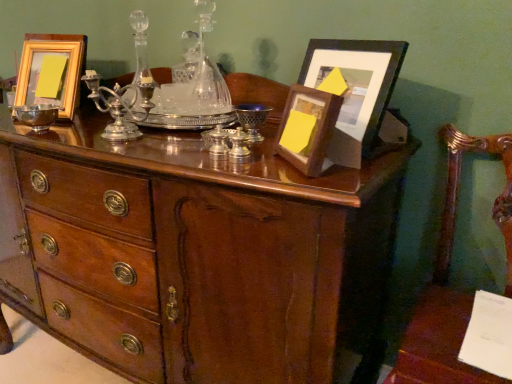
Question: From a real-world perspective, is gold wooden picture frame at upper left, which appears as the 1th picture frame when viewed from the left, physically below silver metallic candle holder at center, the second candle holder viewed from the left?

Choices:
 (A) no
 (B) yes

Answer: (A)

Question: Considering the relative sizes of gold wooden picture frame at upper left, the 3th picture frame in the right-to-left sequence, and silver metallic candle holder at center, the second candle holder viewed from the left, in the image provided, is gold wooden picture frame at upper left, the 3th picture frame in the right-to-left sequence, smaller than silver metallic candle holder at center, the second candle holder viewed from the left,?

Choices:
 (A) no
 (B) yes

Answer: (A)

Question: Is gold wooden picture frame at upper left, the 3th picture frame in the right-to-left sequence, directly adjacent to silver metallic candle holder at center, the second candle holder viewed from the left?

Choices:
 (A) no
 (B) yes

Answer: (A)

Question: Is gold wooden picture frame at upper left, the 3th picture frame in the right-to-left sequence, oriented towards silver metallic candle holder at center, the second candle holder positioned from the front?

Choices:
 (A) no
 (B) yes

Answer: (A)

Question: Can you confirm if gold wooden picture frame at upper left, the 3th picture frame in the right-to-left sequence, is thinner than silver metallic candle holder at center, the second candle holder positioned from the front?

Choices:
 (A) no
 (B) yes

Answer: (A)

Question: Is point (265, 119) closer or farther from the camera than point (296, 167)?

Choices:
 (A) closer
 (B) farther

Answer: (B)

Question: From a real-world perspective, is shiny silver wine glass at center positioned above or below wooden picture frame at upper right, which is the second picture frame from left to right?

Choices:
 (A) above
 (B) below

Answer: (B)

Question: In terms of width, does shiny silver wine glass at center look wider or thinner when compared to wooden picture frame at upper right, which is the second picture frame from left to right?

Choices:
 (A) thin
 (B) wide

Answer: (A)

Question: Which is correct: shiny silver wine glass at center is inside wooden picture frame at upper right, which is the 2th picture frame from right to left, or outside of it?

Choices:
 (A) outside
 (B) inside

Answer: (A)

Question: Considering the positions of silver metallic candle holder at center, marked as the 2th candle holder in a right-to-left arrangement, and wooden armchair at right in the image, is silver metallic candle holder at center, marked as the 2th candle holder in a right-to-left arrangement, wider or thinner than wooden armchair at right?

Choices:
 (A) wide
 (B) thin

Answer: (B)

Question: Would you say silver metallic candle holder at center, the second candle holder viewed from the left, is to the left or to the right of wooden armchair at right in the picture?

Choices:
 (A) left
 (B) right

Answer: (A)

Question: From a real-world perspective, relative to wooden armchair at right, is silver metallic candle holder at center, which appears as the second candle holder when viewed from the back, vertically above or below?

Choices:
 (A) below
 (B) above

Answer: (B)

Question: Which is correct: silver metallic candle holder at center, marked as the 2th candle holder in a right-to-left arrangement, is inside wooden armchair at right, or outside of it?

Choices:
 (A) outside
 (B) inside

Answer: (A)

Question: Based on their positions, is wooden armchair at right located to the left or right of shiny silver candle holder at center, which appears as the third candle holder when viewed from the left?

Choices:
 (A) left
 (B) right

Answer: (B)

Question: From a real-world perspective, is wooden armchair at right physically located above or below shiny silver candle holder at center, which is counted as the 1th candle holder, starting from the right?

Choices:
 (A) below
 (B) above

Answer: (A)